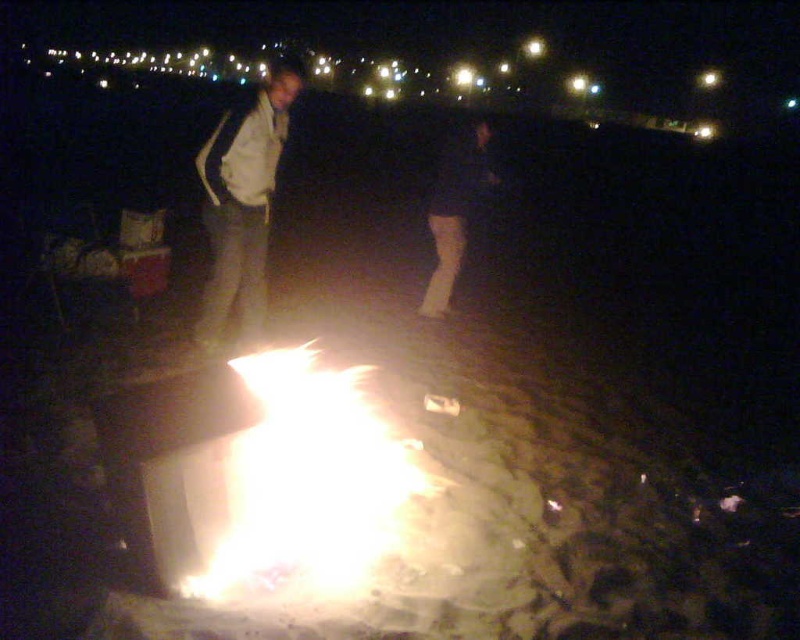
You are a GUI agent. You are given a task and a screenshot of the screen. Output one action in this format:
    pyautogui.click(x=<x>, y=<y>)
    Task: Click on the white matte jacket at center
    The image size is (800, 640).
    Given the screenshot: What is the action you would take?
    pyautogui.click(x=242, y=204)

Which is behind, point (237, 221) or point (438, 216)?

The point (438, 216) is behind.

You are a GUI agent. You are given a task and a screenshot of the screen. Output one action in this format:
    pyautogui.click(x=<x>, y=<y>)
    Task: Click on the white matte jacket at center
    This screenshot has height=640, width=800.
    Given the screenshot: What is the action you would take?
    [x=242, y=204]

Between point (210, 560) and point (474, 195), which one is positioned behind?

The point (474, 195) is behind.

Is flaming wood at center smaller than dark blue jeans at center?

No, flaming wood at center is not smaller than dark blue jeans at center.

Is point (312, 573) positioned behind point (436, 224)?

No, (312, 573) is in front of (436, 224).

This screenshot has width=800, height=640. What are the coordinates of `flaming wood at center` in the screenshot? It's located at (300, 483).

Between point (226, 529) and point (222, 248), which one is positioned in front?

Point (226, 529) is in front.

Between flaming wood at center and white matte jacket at center, which one is positioned lower?

Positioned lower is flaming wood at center.

The height and width of the screenshot is (640, 800). What are the coordinates of `flaming wood at center` in the screenshot? It's located at (300, 483).

At what (x,y) coordinates should I click in order to perform the action: click on flaming wood at center. Please return your answer as a coordinate pair (x, y). Looking at the image, I should click on pos(300,483).